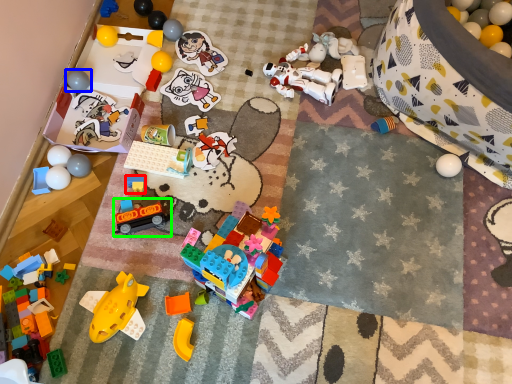
Question: Which object is positioned farthest from toy (highlighted by a red box)? Select from toy (highlighted by a blue box) and toy (highlighted by a green box).

Choices:
 (A) toy
 (B) toy

Answer: (A)